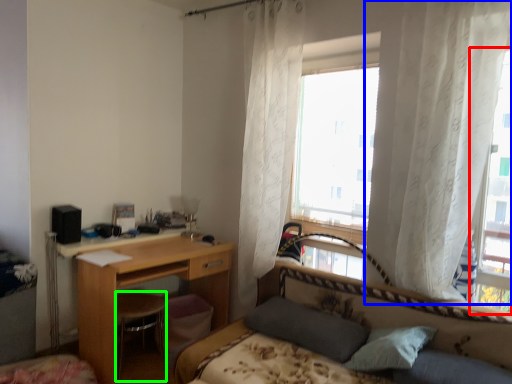
Question: Which object is the closest to the window (highlighted by a red box)? Choose among these: curtain (highlighted by a blue box) or swivel chair (highlighted by a green box).

Choices:
 (A) curtain
 (B) swivel chair

Answer: (A)